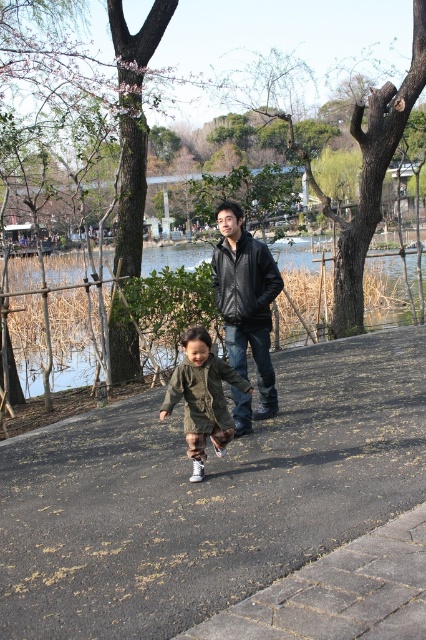
You are a delivery drone that needs to hover above the asphalt at lower center while avoiding any obstacles. Is the leather jacket at center tall enough to interfere with your flight path?

The asphalt at lower center has a lesser height compared to leather jacket at center, so the leather jacket at center is taller. Since the drone needs to hover above the asphalt, the leather jacket at center may interfere with the flight path if it is within the drone flight area.

You are a delivery person who needs to place a large package on the ground. You see the dark asphalt pavement at center and the black leather jacket at center. Which surface is wider and can accommodate the package?

The dark asphalt pavement at center is wider than the black leather jacket at center, so the package can be placed on the dark asphalt pavement at center.

You are a delivery drone with a wingspan of 3 feet. You need to fly between the dark asphalt pavement at center and the black leather jacket at center. Can you fit through the space between them?

The distance between the dark asphalt pavement at center and the black leather jacket at center is 10.99 feet. Since your wingspan is 3 feet, you can easily fit through the space between them as there is more than enough room.